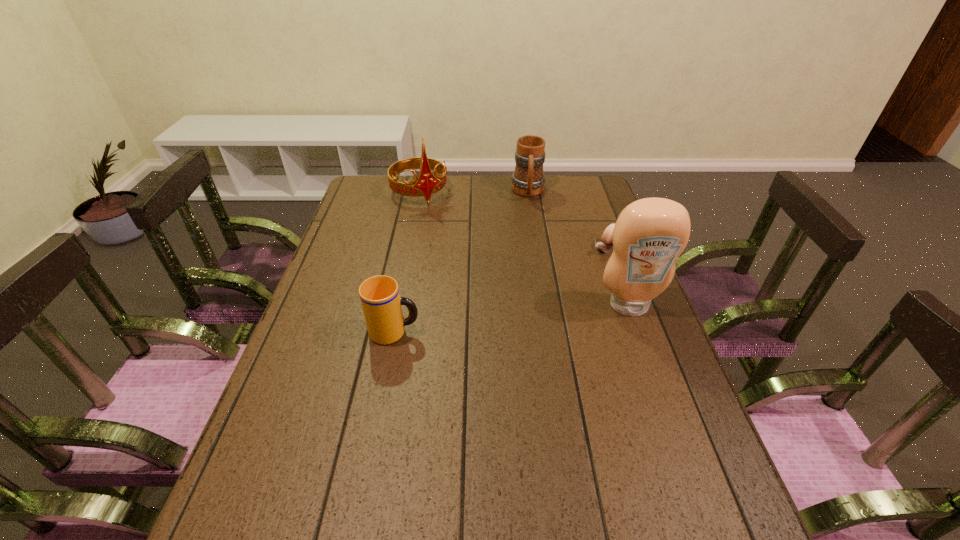
Identify which object is the second nearest to the condiment. Please provide its 2D coordinates. Your answer should be formatted as a tuple, i.e. [(x, y)], where the tuple contains the x and y coordinates of a point satisfying the conditions above.

[(528, 180)]

What are the coordinates of `free location that satisfies the following two spatial constraints: 1. on the front side of the third nearest object; 2. on the right side of the tiara` in the screenshot? It's located at (408, 248).